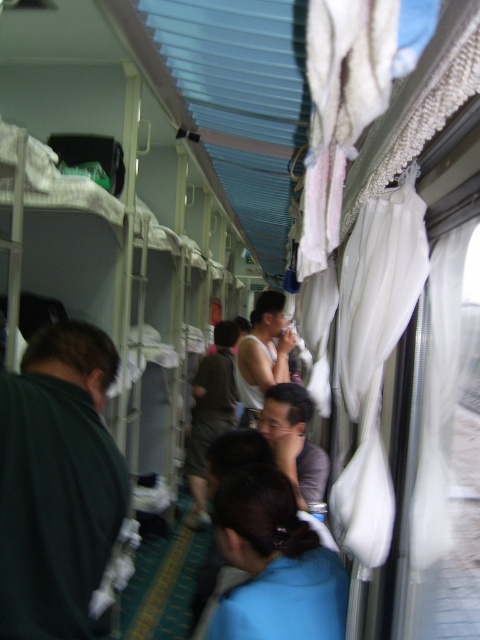
You are a passenger in the train compartment and need to hang a small backpack on a hook. You notice the blue fabric at center and the dark green fabric at center. Which fabric is shorter and thus safer to hang the backpack near to avoid it touching the ground?

The blue fabric at center is not as tall as dark green fabric at center, so the blue fabric at center is shorter. Hanging the backpack near the blue fabric at center would be safer to avoid it touching the ground.

You are a passenger in the train compartment and want to place a small bag between the blue fabric at center and the dark green fabric at center. Can you do this without moving either fabric?

The blue fabric at center is in front of the dark green fabric at center, so you can place the bag between them by positioning it in front of the dark green fabric at center but behind the blue fabric at center.

You are a passenger in the train compartment and want to place a small bag between the blue fabric at center and the dark green fabric at center. Which fabric should you place it closer to if you want it to be on the right side?

The blue fabric at center is to the right of dark green fabric at center, so placing the bag closer to the blue fabric at center will position it on the right side.